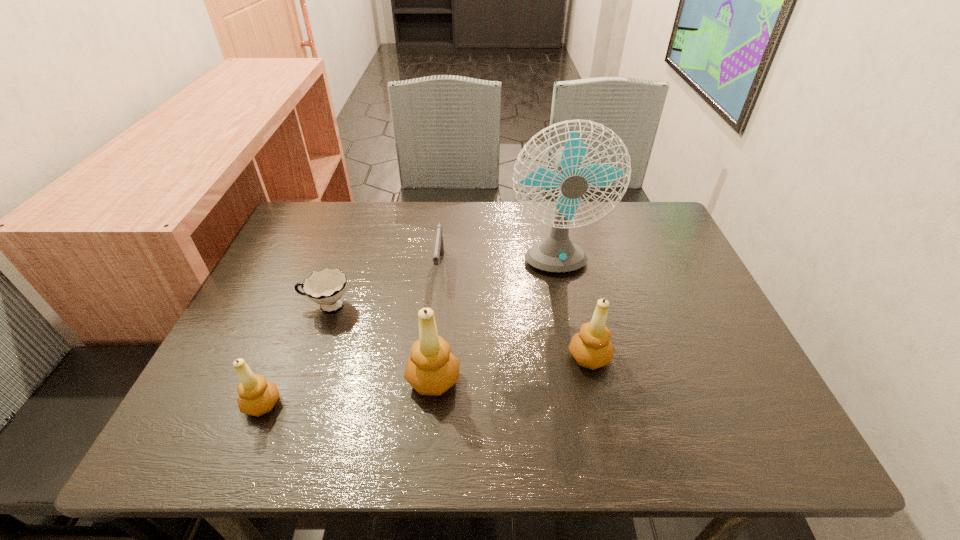
This screenshot has height=540, width=960. Find the location of `empty location between the rightmost candle_holder and the pistol`. empty location between the rightmost candle_holder and the pistol is located at coordinates (515, 312).

The height and width of the screenshot is (540, 960). I want to click on free space between the fan and the third tallest object, so click(x=572, y=312).

Find the location of a particular element. blank region between the second shortest object and the tallest object is located at coordinates (497, 267).

Find the location of a particular element. The height and width of the screenshot is (540, 960). vacant point located between the pistol and the fan is located at coordinates (497, 267).

Locate an element on the screen. The image size is (960, 540). blank region between the second tallest object and the fifth tallest object is located at coordinates (437, 323).

This screenshot has height=540, width=960. I want to click on vacant space that's between the cup and the third tallest object, so click(x=458, y=332).

Find the location of a particular element. The height and width of the screenshot is (540, 960). free point between the second candle_holder from left to right and the tallest object is located at coordinates (493, 323).

You are a GUI agent. You are given a task and a screenshot of the screen. Output one action in this format:
    pyautogui.click(x=<x>, y=<y>)
    Task: Click on the free space between the shortest object and the tallest candle_holder
    This screenshot has height=540, width=960.
    Given the screenshot: What is the action you would take?
    pyautogui.click(x=380, y=343)

Where is `object that ranks as the third closest to the fifth shortest object`? This screenshot has width=960, height=540. object that ranks as the third closest to the fifth shortest object is located at coordinates (591, 348).

Locate which object ranks third in proximity to the tallest object. Please provide its 2D coordinates. Your answer should be formatted as a tuple, i.e. [(x, y)], where the tuple contains the x and y coordinates of a point satisfying the conditions above.

[(431, 369)]